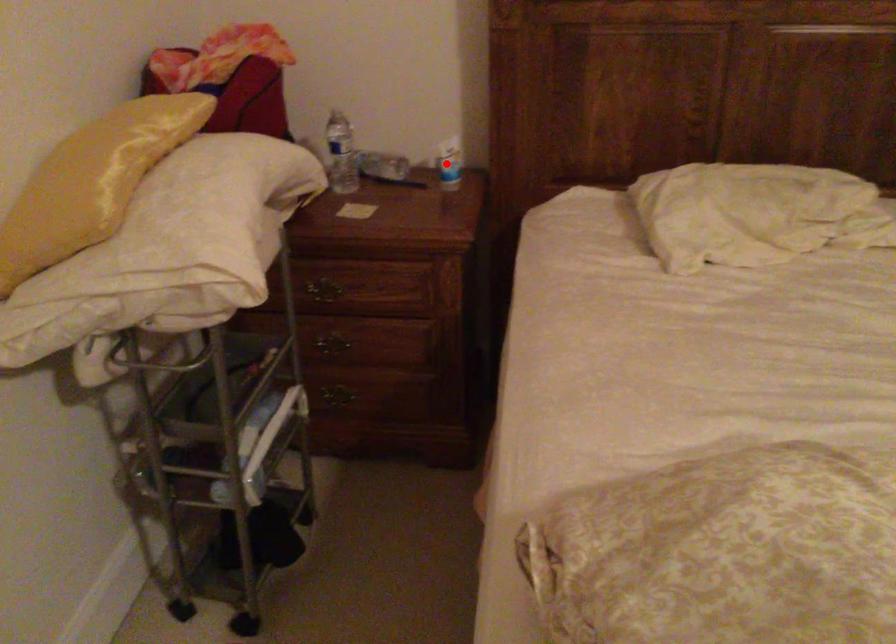
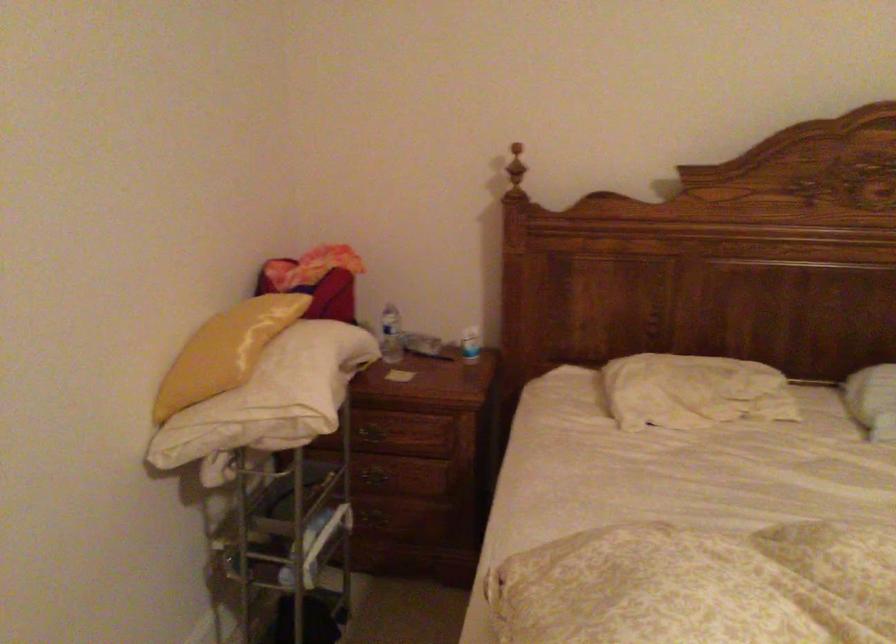
Question: I am providing you with two images of the same scene from different viewpoints. A red point is shown in image1. For the corresponding object point in image2, is it positioned nearer or farther from the camera?

Choices:
 (A) Nearer
 (B) Farther

Answer: (B)